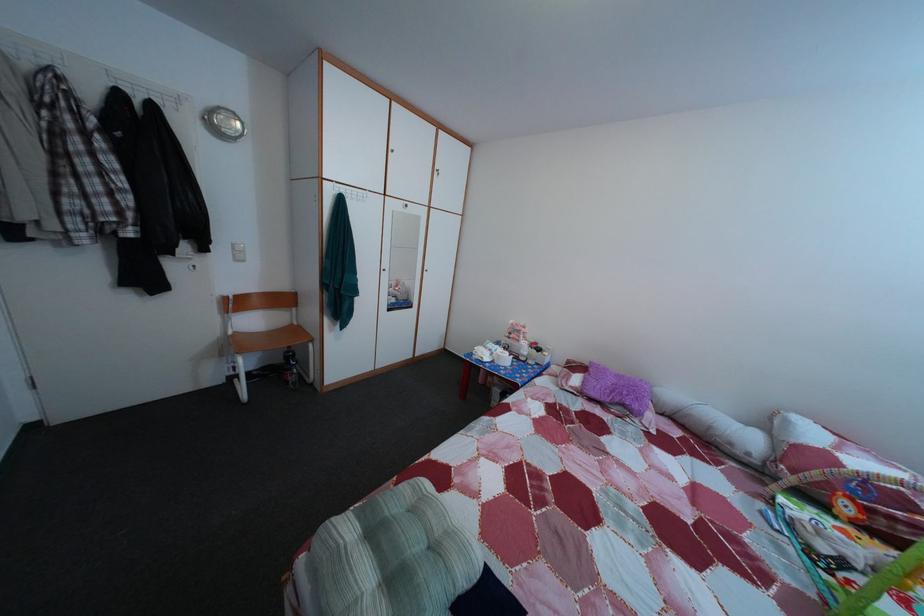
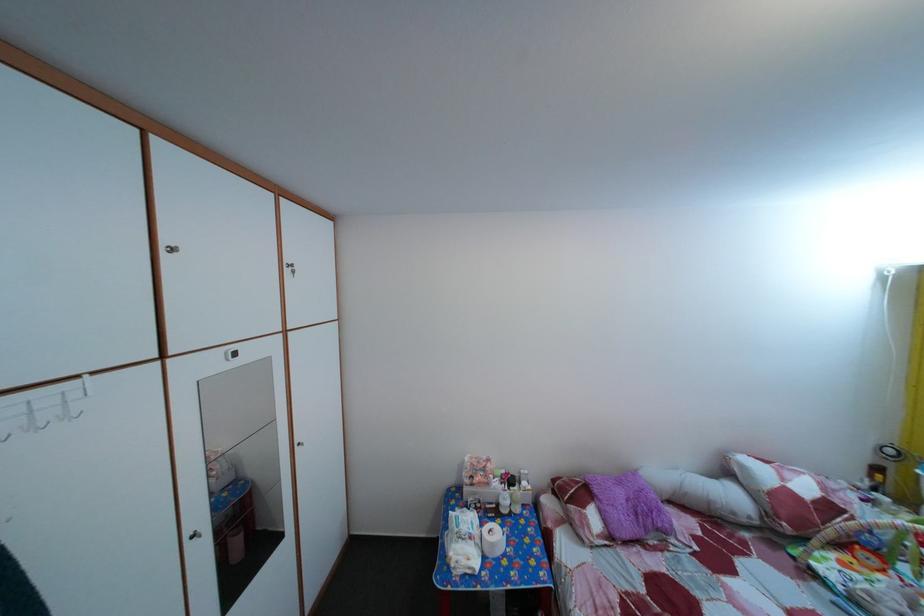
In the second image, find the point that corresponds to the point at 507,363 in the first image.

(502, 553)